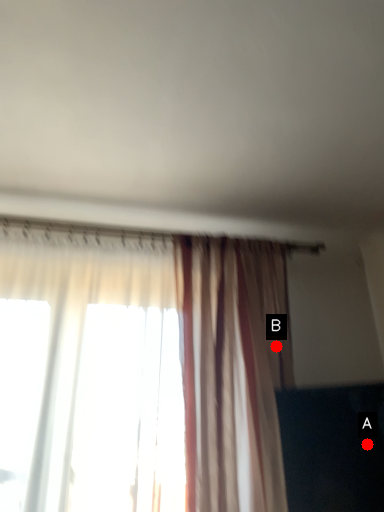
Question: Two points are circled on the image, labeled by A and B beside each circle. Which point is farther to the camera?

Choices:
 (A) A is further
 (B) B is further

Answer: (B)